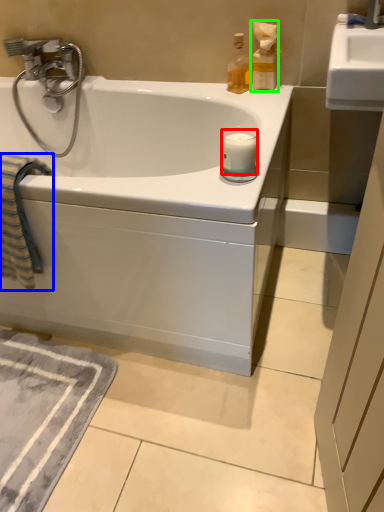
Question: Based on their relative distances, which object is nearer to candle (highlighted by a red box)? Choose from beach towel (highlighted by a blue box) and bottle (highlighted by a green box).

Choices:
 (A) beach towel
 (B) bottle

Answer: (B)